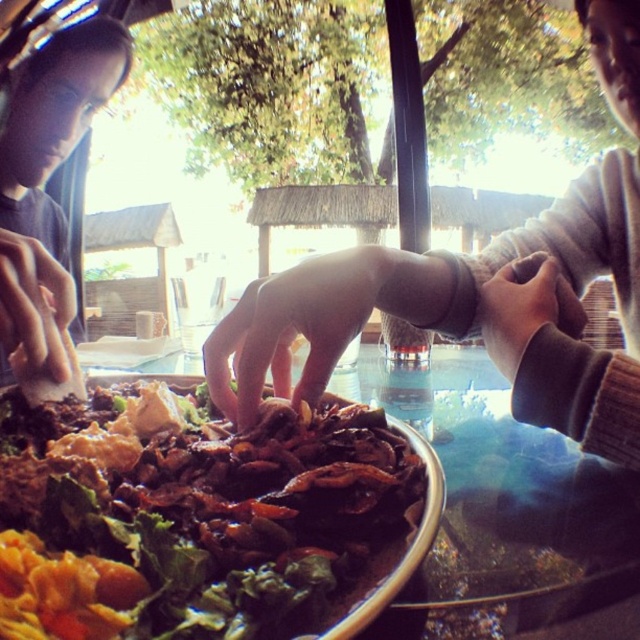
Does point (332, 316) lie behind point (84, 84)?

No, (332, 316) is closer to viewer.

Which is in front, point (308, 264) or point (35, 65)?

Positioned in front is point (308, 264).

This screenshot has width=640, height=640. What do you see at coordinates (291, 328) in the screenshot?
I see `pink matte hand at center` at bounding box center [291, 328].

Where is `pink matte hand at center`? pink matte hand at center is located at coordinates (291, 328).

Between smooth beige hand at center and matte white hand at lower left, which one appears on the left side from the viewer's perspective?

matte white hand at lower left

Between smooth beige hand at center and matte white hand at lower left, which one is positioned higher?

smooth beige hand at center

Image resolution: width=640 pixels, height=640 pixels. What are the coordinates of `smooth beige hand at center` in the screenshot? It's located at (481, 291).

Where is `smooth beige hand at center`? The height and width of the screenshot is (640, 640). smooth beige hand at center is located at coordinates (481, 291).

Can you confirm if smooth beige hand at center is thinner than brown fuzzy sweater at upper right?

No.

Does smooth beige hand at center have a smaller size compared to brown fuzzy sweater at upper right?

Incorrect, smooth beige hand at center is not smaller in size than brown fuzzy sweater at upper right.

Find the location of a particular element. This screenshot has width=640, height=640. smooth beige hand at center is located at coordinates (481, 291).